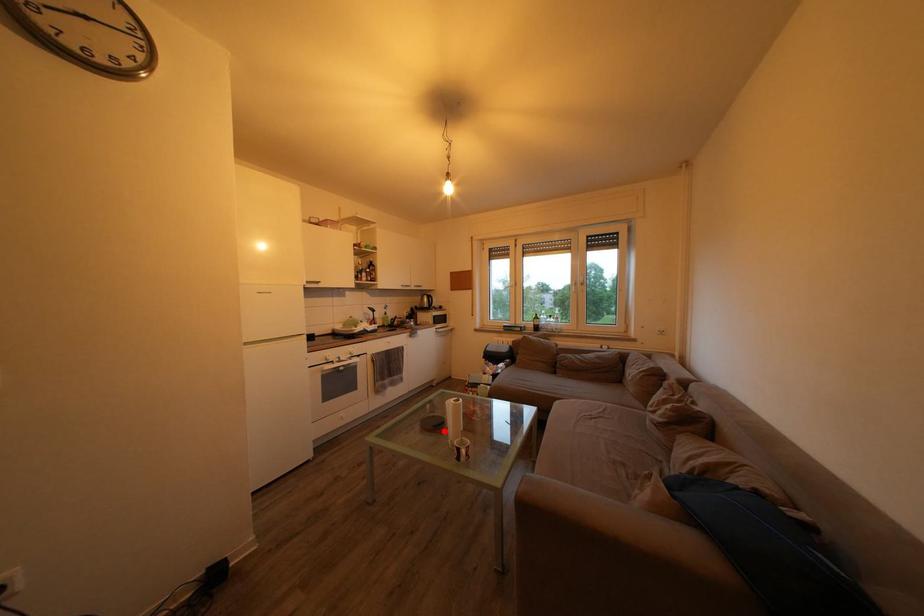
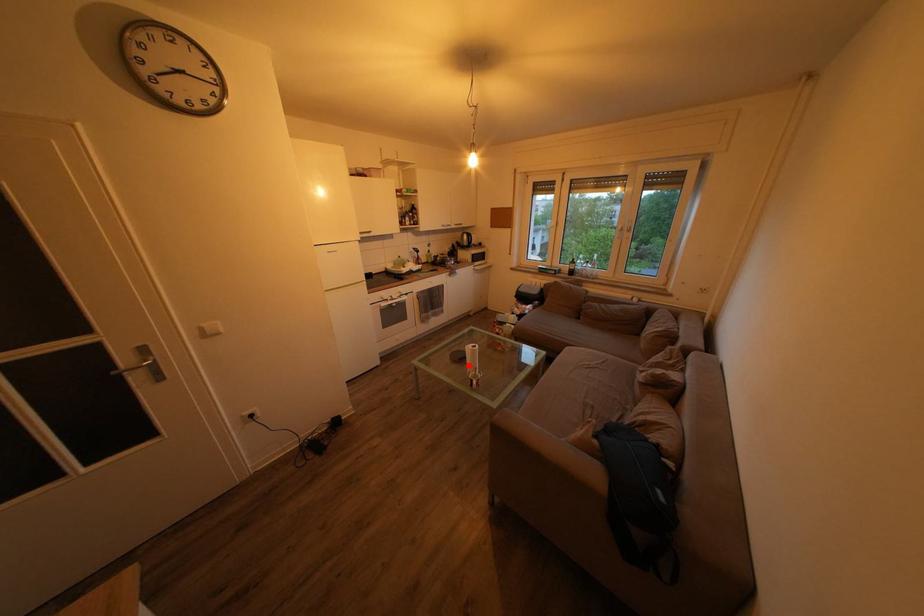
I am providing you with two images of the same scene from different viewpoints. A red point is marked on the first image and another point is marked on the second image. Does the point marked in image1 correspond to the same location as the one in image2?

Yes